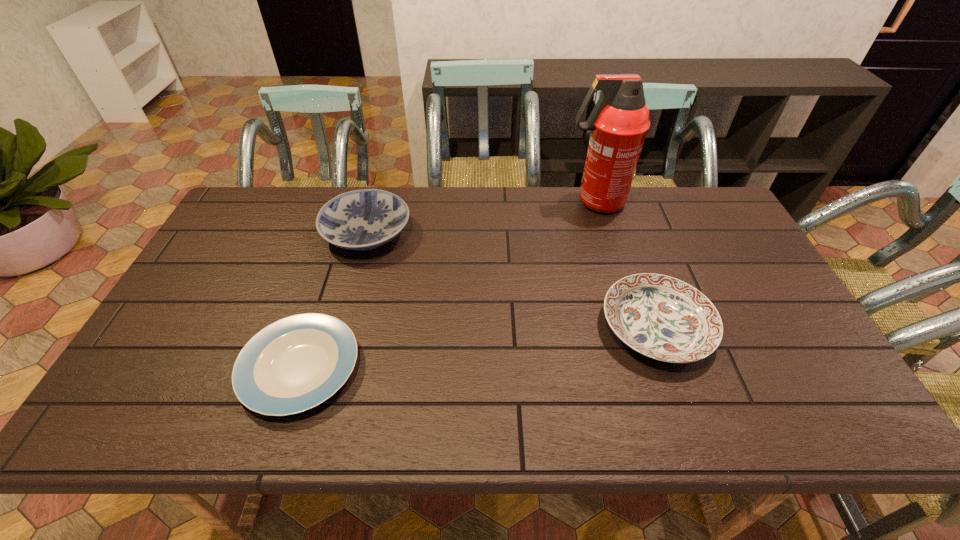
Where is `vacant space that's between the shortest plate and the third shortest object`? vacant space that's between the shortest plate and the third shortest object is located at coordinates (334, 300).

Where is `vacant area between the shortest object and the tallest plate`? This screenshot has height=540, width=960. vacant area between the shortest object and the tallest plate is located at coordinates (334, 300).

In order to click on empty space that is in between the rightmost plate and the third shortest object in this screenshot , I will do `click(512, 280)`.

At what (x,y) coordinates should I click in order to perform the action: click on free spot between the rightmost plate and the shortest plate. Please return your answer as a coordinate pair (x, y). The width and height of the screenshot is (960, 540). Looking at the image, I should click on (478, 347).

Image resolution: width=960 pixels, height=540 pixels. Identify the location of free area in between the third tallest object and the shortest plate. (478, 347).

At what (x,y) coordinates should I click in order to perform the action: click on vacant region between the shortest plate and the rightmost plate. Please return your answer as a coordinate pair (x, y). Looking at the image, I should click on coord(478,347).

Identify the location of free space that is in between the rightmost plate and the tallest plate. Image resolution: width=960 pixels, height=540 pixels. (512, 280).

Identify the location of vacant space that is in between the tallest plate and the tallest object. This screenshot has height=540, width=960. (481, 218).

At what (x,y) coordinates should I click in order to perform the action: click on vacant area that lies between the tallest object and the shortest object. Please return your answer as a coordinate pair (x, y). The image size is (960, 540). Looking at the image, I should click on (447, 285).

Find the location of a particular element. Image resolution: width=960 pixels, height=540 pixels. empty space that is in between the tallest object and the tallest plate is located at coordinates (481, 218).